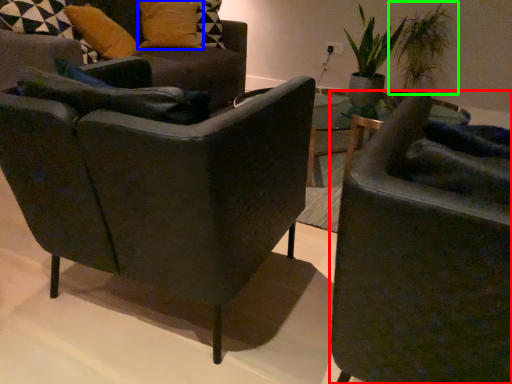
Question: Considering the real-world distances, which object is farthest from chair (highlighted by a red box)? pillow (highlighted by a blue box) or plant (highlighted by a green box)?

Choices:
 (A) pillow
 (B) plant

Answer: (B)